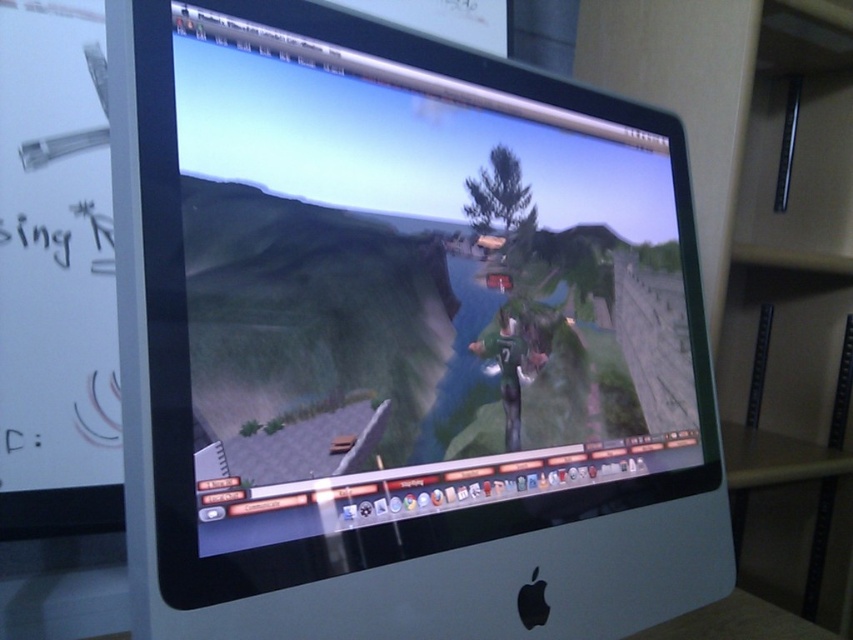
Which is above, satin silver monitor at center or beige wood bookshelf at right?

Positioned higher is satin silver monitor at center.

Describe the element at coordinates (401, 337) in the screenshot. I see `satin silver monitor at center` at that location.

Identify the location of satin silver monitor at center. The width and height of the screenshot is (853, 640). (401, 337).

Find the location of a particular element. This screenshot has width=853, height=640. satin silver monitor at center is located at coordinates (401, 337).